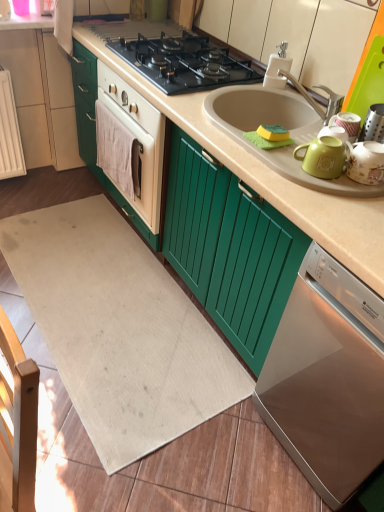
Find the location of a particular element. The width and height of the screenshot is (384, 512). free spot above beige matte countertop at center (from a real-world perspective) is located at coordinates pos(201,66).